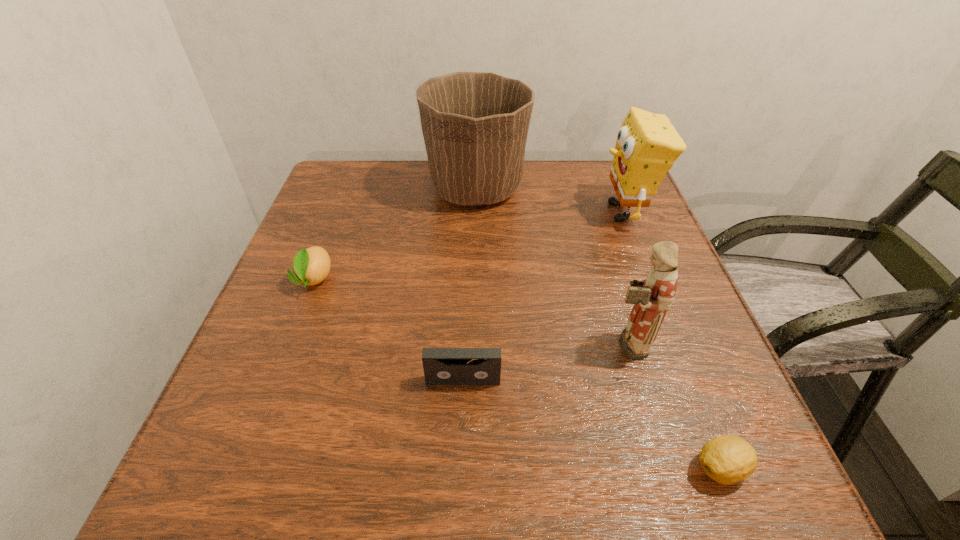
Find the location of a particular element. flowerpot is located at coordinates (475, 124).

You are a GUI agent. You are given a task and a screenshot of the screen. Output one action in this format:
    pyautogui.click(x=<x>, y=<y>)
    Task: Click on the sponge
    Image resolution: width=960 pixels, height=540 pixels.
    Given the screenshot: What is the action you would take?
    pyautogui.click(x=647, y=145)

The height and width of the screenshot is (540, 960). Identify the location of the fourth farthest object. (652, 297).

Where is `videotape`? videotape is located at coordinates (442, 366).

In order to click on the leftmost object in this screenshot , I will do `click(312, 265)`.

Identify the location of the taller lemon. (312, 265).

The height and width of the screenshot is (540, 960). Find the location of `the shortest object`. the shortest object is located at coordinates (728, 459).

You are a GUI agent. You are given a task and a screenshot of the screen. Output one action in this format:
    pyautogui.click(x=<x>, y=<y>)
    Task: Click on the nearest object
    The image size is (960, 540).
    Given the screenshot: What is the action you would take?
    pyautogui.click(x=728, y=459)

The width and height of the screenshot is (960, 540). Identify the location of free space located on the left of the flowerpot. (391, 188).

This screenshot has width=960, height=540. Identify the location of free space located on the face of the sponge. pyautogui.click(x=535, y=212).